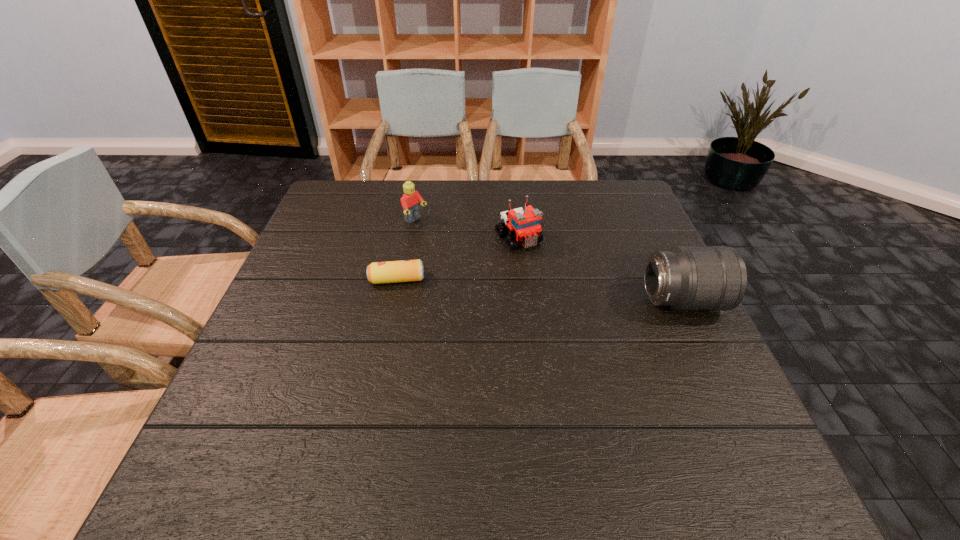
What are the coordinates of `the shortest object` in the screenshot? It's located at pyautogui.click(x=405, y=270).

In order to click on the rightmost object in this screenshot , I will do click(x=714, y=278).

At what (x,y) coordinates should I click in order to perform the action: click on telephoto lens. Please return your answer as a coordinate pair (x, y). The width and height of the screenshot is (960, 540). Looking at the image, I should click on (714, 278).

You are a GUI agent. You are given a task and a screenshot of the screen. Output one action in this format:
    pyautogui.click(x=<x>, y=<y>)
    Task: Click on the left Lego
    This screenshot has width=960, height=540.
    Given the screenshot: What is the action you would take?
    pyautogui.click(x=410, y=201)

Image resolution: width=960 pixels, height=540 pixels. I want to click on the right Lego, so click(x=523, y=223).

You are a GUI agent. You are given a task and a screenshot of the screen. Output one action in this format:
    pyautogui.click(x=<x>, y=<y>)
    Task: Click on the free space located 0.230m on the back of the beer can
    
    Given the screenshot: What is the action you would take?
    pyautogui.click(x=410, y=219)

Where is `free point located 0.100m on the face of the left Lego`? The height and width of the screenshot is (540, 960). free point located 0.100m on the face of the left Lego is located at coordinates (447, 240).

You are a GUI agent. You are given a task and a screenshot of the screen. Output one action in this format:
    pyautogui.click(x=<x>, y=<y>)
    Task: Click on the vacant space located on the face of the left Lego
    The height and width of the screenshot is (540, 960).
    Given the screenshot: What is the action you would take?
    pyautogui.click(x=473, y=256)

At what (x,y) coordinates should I click in order to perform the action: click on free location located 0.270m on the face of the left Lego. Please return your answer as a coordinate pair (x, y). This screenshot has height=540, width=960. Looking at the image, I should click on (493, 269).

I want to click on vacant space situated on the front-facing side of the right Lego, so click(x=623, y=367).